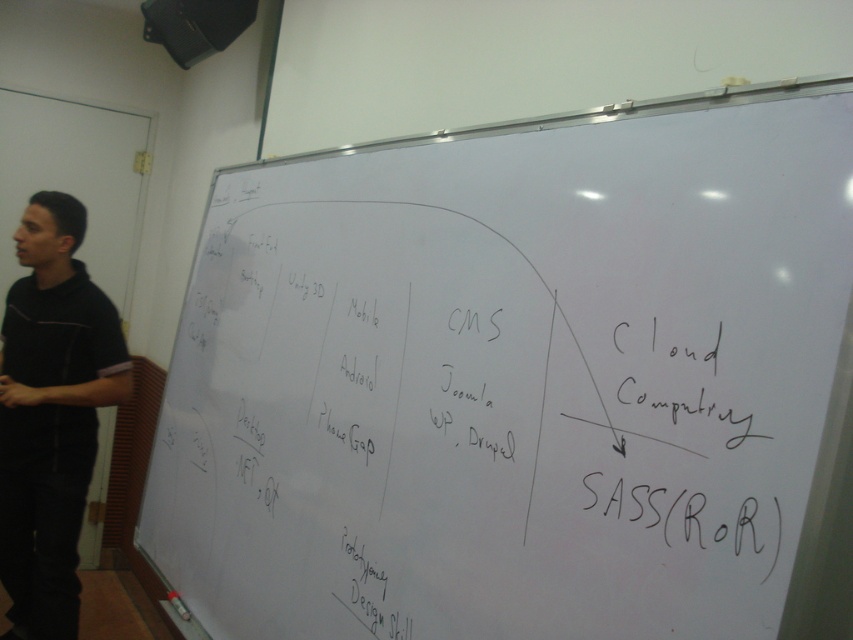
Which of these two, white matte board at center or black fabric shirt at left, stands shorter?

Standing shorter between the two is white matte board at center.

This screenshot has width=853, height=640. I want to click on white matte board at center, so click(x=519, y=380).